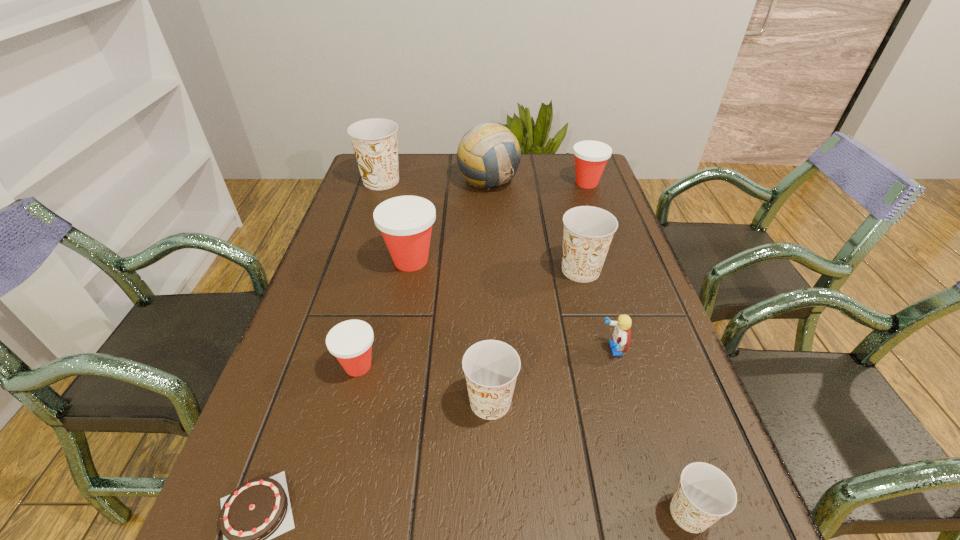
Image resolution: width=960 pixels, height=540 pixels. I want to click on object that is the ninth closest one to the biggest red-orange Dixie cup, so tap(705, 494).

Identify which object is the ninth closest to the chocolate cake. Please provide its 2D coordinates. Your answer should be formatted as a tuple, i.e. [(x, y)], where the tuple contains the x and y coordinates of a point satisfying the conditions above.

[(591, 157)]

I want to click on Dixie cup that stands as the sixth closest to the second biggest orange Dixie cup, so click(374, 141).

You are a GUI agent. You are given a task and a screenshot of the screen. Output one action in this format:
    pyautogui.click(x=<x>, y=<y>)
    Task: Click on the Dixie cup that is the third closest to the second smallest orange Dixie cup
    This screenshot has height=540, width=960.
    Given the screenshot: What is the action you would take?
    pyautogui.click(x=588, y=231)

Where is `orange Dixie cup object that ranks as the closest to the Lego`? The image size is (960, 540). orange Dixie cup object that ranks as the closest to the Lego is located at coordinates (588, 231).

Point out which orange Dixie cup is positioned as the third nearest to the second biggest orange Dixie cup. Please provide its 2D coordinates. Your answer should be formatted as a tuple, i.e. [(x, y)], where the tuple contains the x and y coordinates of a point satisfying the conditions above.

[(374, 141)]

Locate which red-orange Dixie cup ranks second in proximity to the third biggest orange Dixie cup. Please provide its 2D coordinates. Your answer should be formatted as a tuple, i.e. [(x, y)], where the tuple contains the x and y coordinates of a point satisfying the conditions above.

[(405, 222)]

Where is `red-orange Dixie cup that is the second closest to the biggest red-orange Dixie cup`? red-orange Dixie cup that is the second closest to the biggest red-orange Dixie cup is located at coordinates (591, 157).

Identify the location of free spot that satisfies the following two spatial constraints: 1. on the front side of the second nearest red-orange Dixie cup; 2. on the left side of the second farthest orange Dixie cup. Image resolution: width=960 pixels, height=540 pixels. (409, 270).

The width and height of the screenshot is (960, 540). I want to click on free location that satisfies the following two spatial constraints: 1. on the front side of the rightmost red-orange Dixie cup; 2. on the front-facing side of the Lego, so click(645, 349).